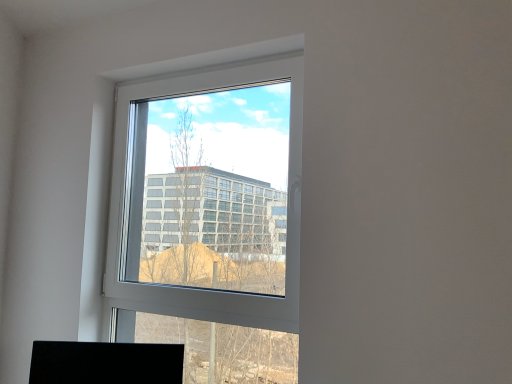
Question: From the image's perspective, relative to black matte desktop at lower left, is white plastic window at center above or below?

Choices:
 (A) above
 (B) below

Answer: (A)

Question: Is white plastic window at center wider or thinner than black matte desktop at lower left?

Choices:
 (A) wide
 (B) thin

Answer: (B)

Question: Visually, is white plastic window at center positioned to the left or to the right of black matte desktop at lower left?

Choices:
 (A) right
 (B) left

Answer: (A)

Question: In the image, is black matte desktop at lower left positioned in front of or behind white plastic window at center?

Choices:
 (A) front
 (B) behind

Answer: (B)

Question: Based on their sizes in the image, would you say black matte desktop at lower left is bigger or smaller than white plastic window at center?

Choices:
 (A) big
 (B) small

Answer: (B)

Question: Based on their positions, is black matte desktop at lower left located to the left or right of white plastic window at center?

Choices:
 (A) left
 (B) right

Answer: (A)

Question: Considering the positions of point (156, 380) and point (282, 69), is point (156, 380) closer or farther from the camera than point (282, 69)?

Choices:
 (A) closer
 (B) farther

Answer: (A)